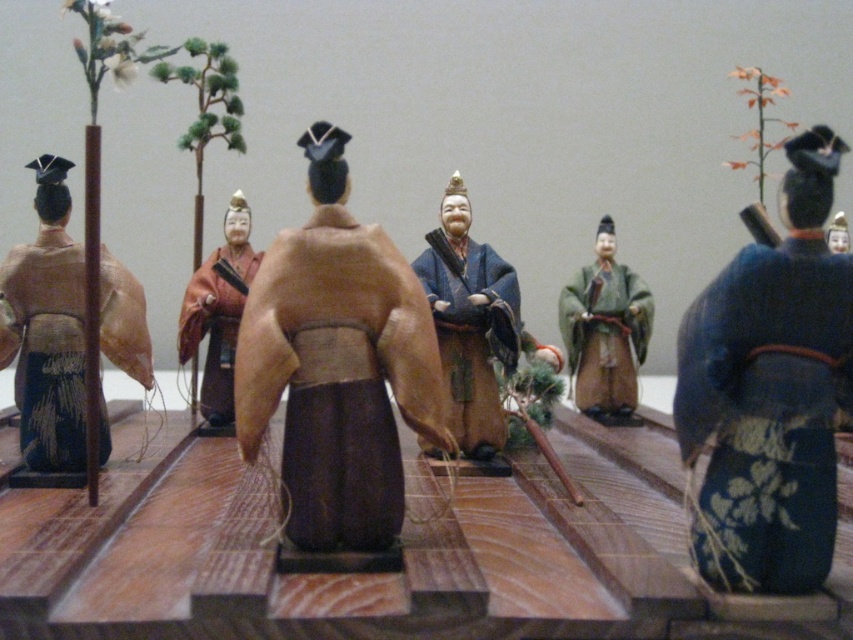
Question: Is matte brown kimono at left bigger than blue silk robe at center?

Choices:
 (A) no
 (B) yes

Answer: (B)

Question: Among these points, which one is farthest from the camera?

Choices:
 (A) (322, 516)
 (B) (236, 280)
 (C) (461, 298)

Answer: (B)

Question: Which of the following is the farthest from the observer?

Choices:
 (A) blue silk kimono at right
 (B) blue silk robe at center
 (C) brown matte kimono at center
 (D) green matte kimono at center

Answer: (D)

Question: Among these points, which one is nearest to the camera?

Choices:
 (A) (485, 356)
 (B) (599, 410)
 (C) (218, 310)
 (D) (373, 326)

Answer: (D)

Question: Does brown matte kimono at center appear over matte brown robe at center?

Choices:
 (A) no
 (B) yes

Answer: (A)

Question: Does blue silk robe at center appear on the right side of matte brown robe at center?

Choices:
 (A) yes
 (B) no

Answer: (A)